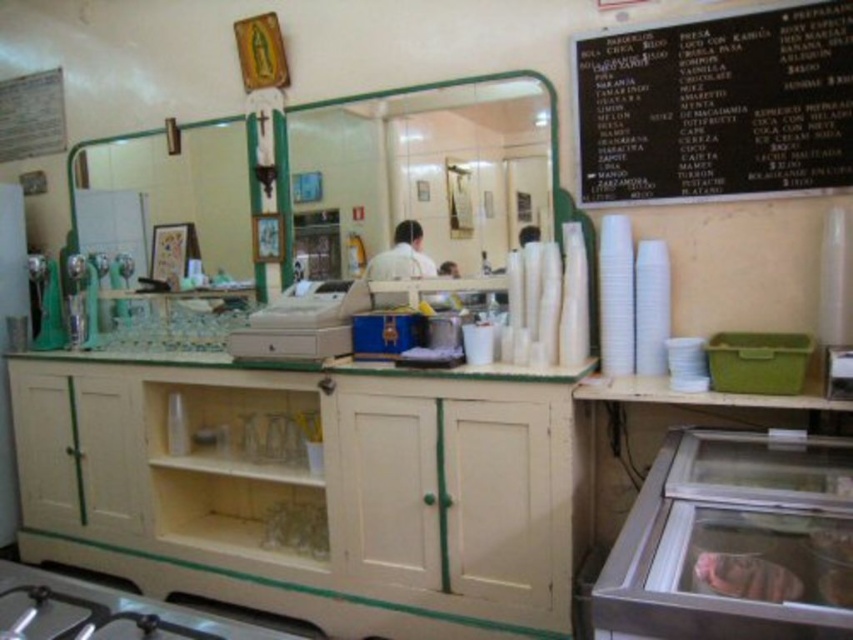
Does transparent glass display case at lower right have a greater width compared to white matte shirt at center?

Correct, the width of transparent glass display case at lower right exceeds that of white matte shirt at center.

Which of these two, transparent glass display case at lower right or white matte shirt at center, stands taller?

white matte shirt at center is taller.

Is point (845, 577) behind point (403, 275)?

No, (845, 577) is closer to viewer.

What are the coordinates of `transparent glass display case at lower right` in the screenshot? It's located at (734, 541).

Can you confirm if black chalkboard at upper right is taller than transparent glass display case at lower right?

Yes, black chalkboard at upper right is taller than transparent glass display case at lower right.

Between point (585, 154) and point (724, 572), which one is positioned behind?

Positioned behind is point (585, 154).

Which is behind, point (781, 51) or point (809, 630)?

Positioned behind is point (781, 51).

Find the location of `black chalkboard at upper right`. black chalkboard at upper right is located at coordinates (717, 106).

Does black chalkboard at upper right have a greater height compared to white matte shirt at center?

Yes.

Is the position of black chalkboard at upper right more distant than that of white matte shirt at center?

No, black chalkboard at upper right is in front of white matte shirt at center.

At what (x,y) coordinates should I click in order to perform the action: click on black chalkboard at upper right. Please return your answer as a coordinate pair (x, y). Looking at the image, I should click on (717, 106).